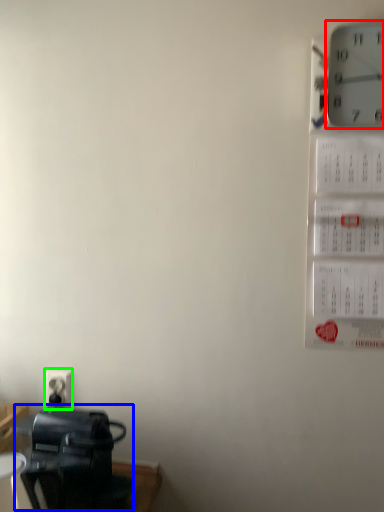
Question: Which object is positioned closest to wall clock (highlighted by a red box)? Select from appliance (highlighted by a blue box) and electric outlet (highlighted by a green box).

Choices:
 (A) appliance
 (B) electric outlet

Answer: (A)